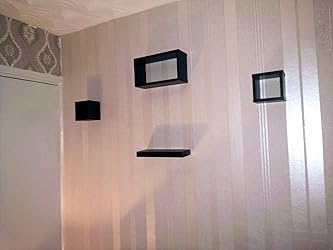
You are a GUI agent. You are given a task and a screenshot of the screen. Output one action in this format:
    pyautogui.click(x=<x>, y=<y>)
    Task: Click on the objects placed on wall
    The image size is (333, 250).
    Given the screenshot: What is the action you would take?
    pyautogui.click(x=164, y=149), pyautogui.click(x=282, y=100), pyautogui.click(x=179, y=67), pyautogui.click(x=86, y=108)